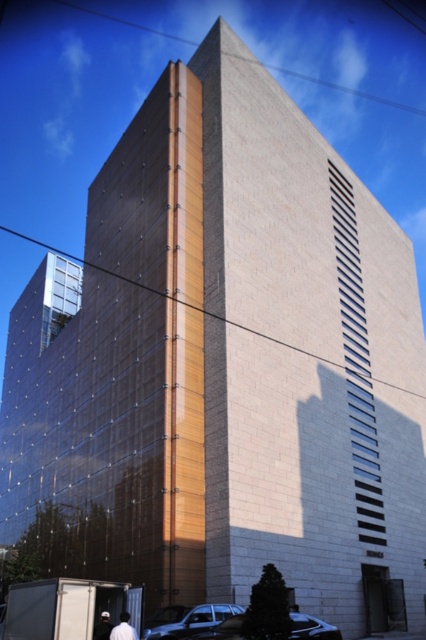
You are a photographer standing in front of the modern architectural structure. You want to capture a photo that includes both the white cotton shirt at lower left and the white matte person at lower center. Based on their sizes, which object should you focus on first to ensure both are in frame?

The white cotton shirt at lower left is smaller than the white matte person at lower center, so you should focus on the white matte person at lower center first to ensure both fit within the frame.

You are standing in front of the modern architectural structure and see a white cotton shirt at lower left and a white matte person at lower center. Which object is shorter?

The white cotton shirt at lower left is not as tall as the white matte person at lower center, so the white cotton shirt at lower left is shorter.

You are standing in front of the modern architectural structure and notice the metallic silver car at lower center and the white cotton cap at lower left. Which object is positioned lower in the scene?

The metallic silver car at lower center is positioned below the white cotton cap at lower left, so it is lower in the scene.